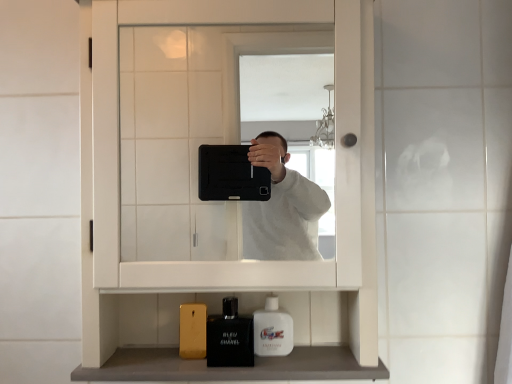
Question: Considering the relative sizes of white glossy mouthwash at lower center and matte black perfume at lower center in the image provided, is white glossy mouthwash at lower center wider than matte black perfume at lower center?

Choices:
 (A) no
 (B) yes

Answer: (A)

Question: Is white glossy mouthwash at lower center to the left of matte black perfume at lower center from the viewer's perspective?

Choices:
 (A) yes
 (B) no

Answer: (B)

Question: Would you consider white glossy mouthwash at lower center to be distant from matte black perfume at lower center?

Choices:
 (A) no
 (B) yes

Answer: (A)

Question: Would you say white glossy mouthwash at lower center is outside matte black perfume at lower center?

Choices:
 (A) no
 (B) yes

Answer: (B)

Question: Is white glossy mouthwash at lower center in contact with matte black perfume at lower center?

Choices:
 (A) no
 (B) yes

Answer: (B)

Question: From a real-world perspective, is matte black perfume at lower center above or below white glossy mouthwash at lower center?

Choices:
 (A) below
 (B) above

Answer: (A)

Question: Considering the positions of point (236, 302) and point (276, 317), is point (236, 302) closer or farther from the camera than point (276, 317)?

Choices:
 (A) closer
 (B) farther

Answer: (B)

Question: Looking at the image, does matte black perfume at lower center seem bigger or smaller compared to white glossy mouthwash at lower center?

Choices:
 (A) big
 (B) small

Answer: (A)

Question: In terms of height, does matte black perfume at lower center look taller or shorter compared to white glossy mouthwash at lower center?

Choices:
 (A) tall
 (B) short

Answer: (A)

Question: Is matte black perfume at lower center spatially inside smooth gray countertop at lower center, or outside of it?

Choices:
 (A) inside
 (B) outside

Answer: (B)

Question: Is matte black perfume at lower center wider or thinner than smooth gray countertop at lower center?

Choices:
 (A) thin
 (B) wide

Answer: (A)

Question: From a real-world perspective, relative to smooth gray countertop at lower center, is matte black perfume at lower center vertically above or below?

Choices:
 (A) above
 (B) below

Answer: (A)

Question: From the image's perspective, is matte black perfume at lower center positioned above or below smooth gray countertop at lower center?

Choices:
 (A) below
 (B) above

Answer: (B)

Question: Is point (283, 322) closer or farther from the camera than point (241, 377)?

Choices:
 (A) closer
 (B) farther

Answer: (B)

Question: In terms of height, does white glossy mouthwash at lower center look taller or shorter compared to smooth gray countertop at lower center?

Choices:
 (A) tall
 (B) short

Answer: (A)